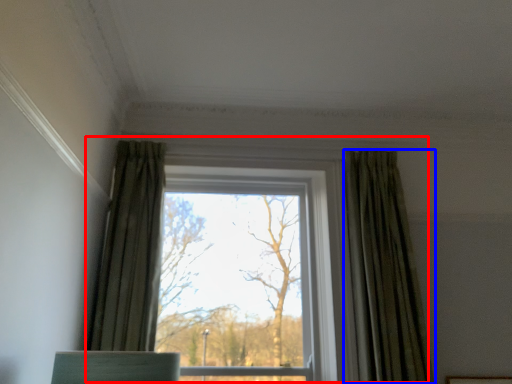
Question: Which object is further to the camera taking this photo, window (highlighted by a red box) or curtain (highlighted by a blue box)?

Choices:
 (A) window
 (B) curtain

Answer: (A)